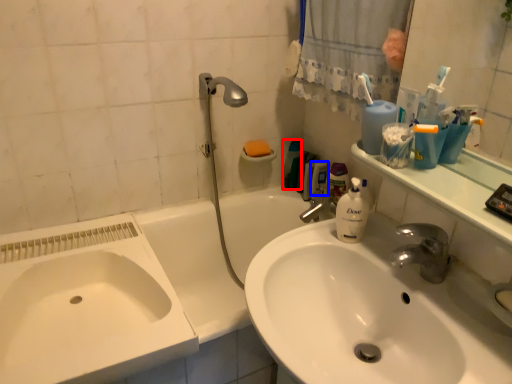
Question: Among these objects, which one is nearest to the camera, cleaning product (highlighted by a red box) or mouthwash (highlighted by a blue box)?

Choices:
 (A) cleaning product
 (B) mouthwash

Answer: (B)